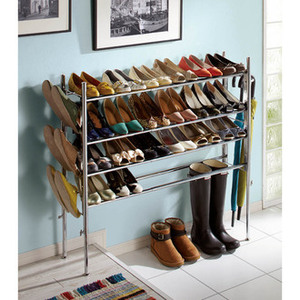
You are a GUI agent. You are given a task and a screenshot of the screen. Output one action in this format:
    pyautogui.click(x=<x>, y=<y>)
    Task: Click on the block glass
    Image resolution: width=300 pixels, height=300 pixels.
    Given the screenshot: What is the action you would take?
    pyautogui.click(x=274, y=187), pyautogui.click(x=276, y=162), pyautogui.click(x=276, y=138), pyautogui.click(x=275, y=114), pyautogui.click(x=271, y=88), pyautogui.click(x=270, y=62), pyautogui.click(x=275, y=37), pyautogui.click(x=274, y=11)